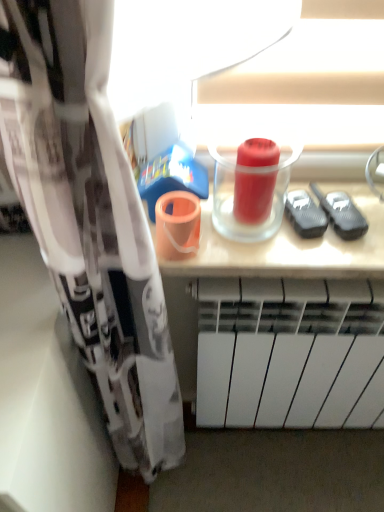
Where is `white matte radiator at lower center`? This screenshot has width=384, height=512. white matte radiator at lower center is located at coordinates (290, 353).

This screenshot has height=512, width=384. Describe the element at coordinates (290, 353) in the screenshot. I see `white matte radiator at lower center` at that location.

In order to face red matte cup at center, should I rotate leftwards or rightwards?

To align with it, rotate right about 8.132°.

The height and width of the screenshot is (512, 384). Describe the element at coordinates (253, 197) in the screenshot. I see `red matte cup at center` at that location.

Where is `red matte cup at center`? red matte cup at center is located at coordinates (253, 197).

What is the approximate width of red matte cup at center?

It is 1.74 inches.

This screenshot has height=512, width=384. Identify the location of white matte radiator at lower center. (290, 353).

Between white matte radiator at lower center and red matte cup at center, which one appears on the right side from the viewer's perspective?

white matte radiator at lower center.

Between white matte radiator at lower center and red matte cup at center, which one is positioned behind?

white matte radiator at lower center is behind.

Considering the points (316, 341) and (271, 176), which point is in front, point (316, 341) or point (271, 176)?

The point (271, 176) is more forward.

Consider the image. From the image's perspective, would you say white matte radiator at lower center is shown under red matte cup at center?

Indeed, from the image's perspective, white matte radiator at lower center is shown beneath red matte cup at center.

From a real-world perspective, between white matte radiator at lower center and red matte cup at center, who is vertically lower?

white matte radiator at lower center, from a real-world perspective.

Between white matte radiator at lower center and red matte cup at center, which one has larger width?

Wider between the two is white matte radiator at lower center.

Considering the sizes of objects white matte radiator at lower center and red matte cup at center in the image provided, who is taller, white matte radiator at lower center or red matte cup at center?

white matte radiator at lower center is taller.

From the picture: Can you confirm if white matte radiator at lower center is bigger than red matte cup at center?

Yes.

Is white matte radiator at lower center inside or outside of red matte cup at center?

white matte radiator at lower center is outside red matte cup at center.

Is white matte radiator at lower center far away from red matte cup at center?

Actually, white matte radiator at lower center and red matte cup at center are a little close together.

Could you tell me if white matte radiator at lower center is turned towards red matte cup at center?

No, white matte radiator at lower center is not aimed at red matte cup at center.

Locate an element on the screen. The height and width of the screenshot is (512, 384). radiator located behind the red matte cup at center is located at coordinates (290, 353).

Considering the relative positions of red matte cup at center and white matte radiator at lower center in the image provided, is red matte cup at center to the left or to the right of white matte radiator at lower center?

red matte cup at center is positioned on white matte radiator at lower center's left side.

Which object is more forward, red matte cup at center or white matte radiator at lower center?

red matte cup at center.

Which is farther from the camera, (251, 149) or (249, 371)?

The point (249, 371) is farther from the camera.

From the image's perspective, would you say red matte cup at center is shown under white matte radiator at lower center?

Incorrect, from the image's perspective, red matte cup at center is higher than white matte radiator at lower center.

From a real-world perspective, which is physically below, red matte cup at center or white matte radiator at lower center?

white matte radiator at lower center is physically lower.

Which object is wider, red matte cup at center or white matte radiator at lower center?

With larger width is white matte radiator at lower center.

Who is shorter, red matte cup at center or white matte radiator at lower center?

red matte cup at center is shorter.

Considering the relative sizes of red matte cup at center and white matte radiator at lower center in the image provided, is red matte cup at center bigger than white matte radiator at lower center?

Incorrect, red matte cup at center is not larger than white matte radiator at lower center.

Do you think red matte cup at center is within white matte radiator at lower center, or outside of it?

red matte cup at center exists outside the volume of white matte radiator at lower center.

Is red matte cup at center beside white matte radiator at lower center?

They are not placed beside each other.

Is red matte cup at center facing towards white matte radiator at lower center?

No.

Can you tell me how much red matte cup at center and white matte radiator at lower center differ in facing direction?

1.01 degrees.

From the picture: How much distance is there between red matte cup at center and white matte radiator at lower center?

The distance of red matte cup at center from white matte radiator at lower center is 15.60 inches.

At what (x,y) coordinates should I click in order to perform the action: click on radiator located below the red matte cup at center (from the image's perspective). Please return your answer as a coordinate pair (x, y). The height and width of the screenshot is (512, 384). Looking at the image, I should click on (290, 353).

Find the location of a particular element. The height and width of the screenshot is (512, 384). beverage lying in front of the white matte radiator at lower center is located at coordinates (253, 197).

Locate an element on the screen. This screenshot has height=512, width=384. beverage located above the white matte radiator at lower center (from the image's perspective) is located at coordinates (253, 197).